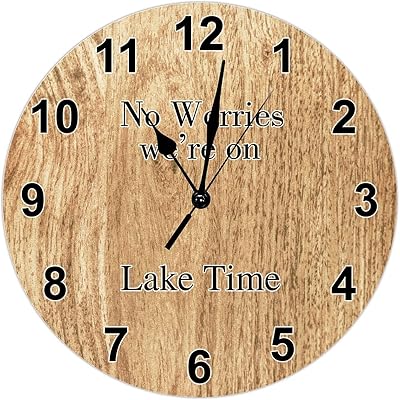
Find the location of a particular element. The image size is (400, 400). second clock hand is located at coordinates (265, 101).